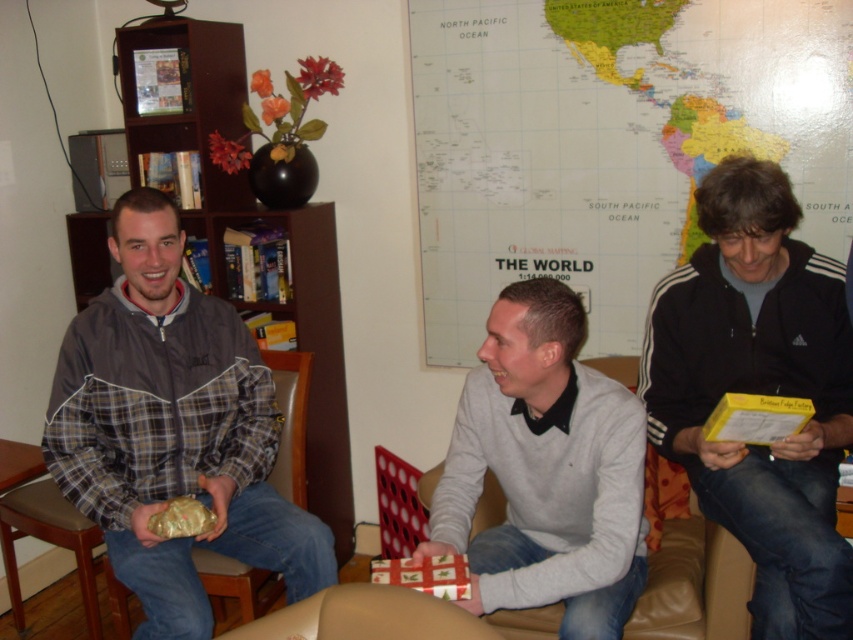
Question: Which of the following is the farthest from the observer?

Choices:
 (A) (311, 632)
 (B) (149, 548)
 (C) (119, 29)
 (D) (547, 369)

Answer: (C)

Question: Is world map at center above brown wood bookshelf at left?

Choices:
 (A) no
 (B) yes

Answer: (B)

Question: Can you confirm if black matte jacket at right is wider than brown leather armchair at lower left?

Choices:
 (A) yes
 (B) no

Answer: (B)

Question: Which object is positioned farthest from the light gray sweater at center?

Choices:
 (A) leather couch at lower center
 (B) plaid fabric jacket at center

Answer: (B)

Question: Which object is farther from the camera taking this photo?

Choices:
 (A) light gray sweater at center
 (B) world map at center
 (C) brown leather armchair at lower left
 (D) brown wood bookshelf at left

Answer: (D)

Question: Observing the image, what is the correct spatial positioning of black matte jacket at right in reference to leather couch at lower center?

Choices:
 (A) below
 (B) above

Answer: (B)